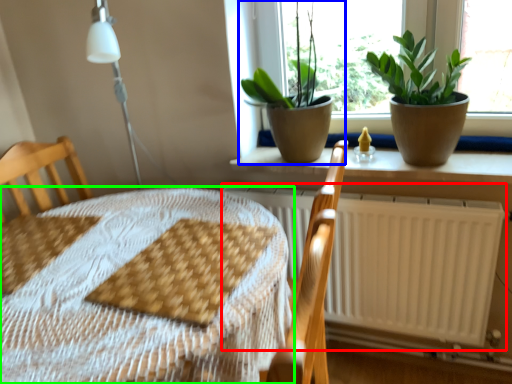
Question: Based on their relative distances, which object is farther from radiator (highlighted by a red box)? Choose from houseplant (highlighted by a blue box) and table (highlighted by a green box).

Choices:
 (A) houseplant
 (B) table

Answer: (B)